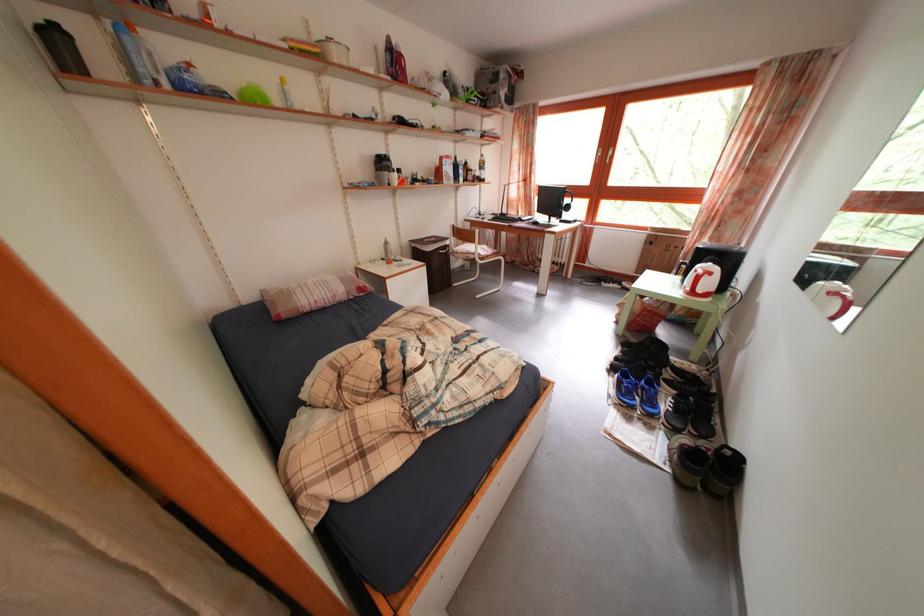
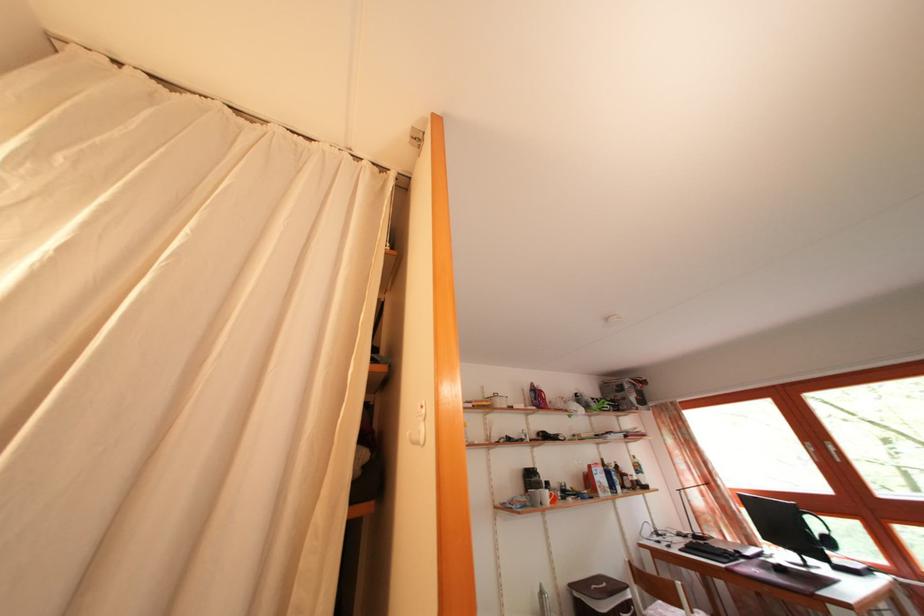
In the second image, find the point that corresponds to point 444,185 in the first image.

(593, 495)